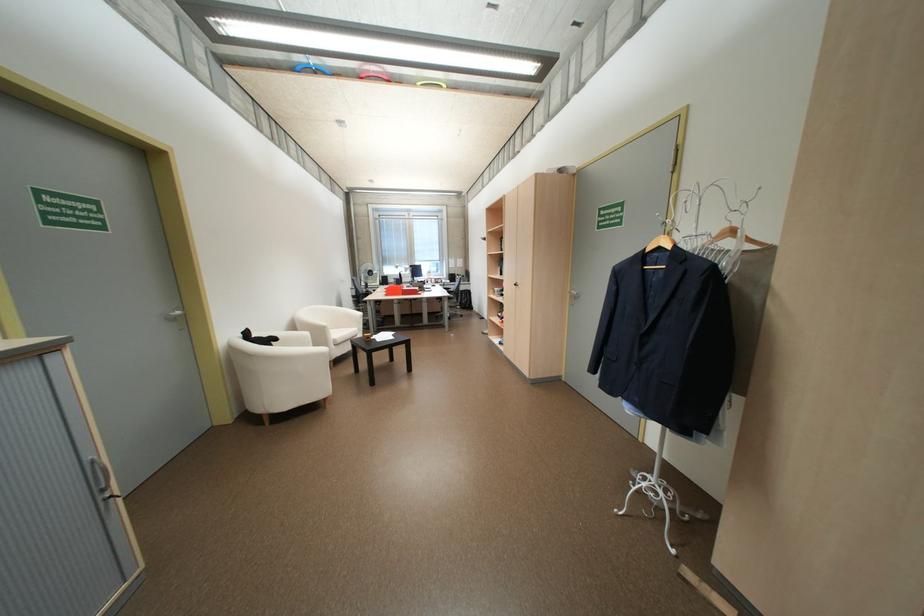
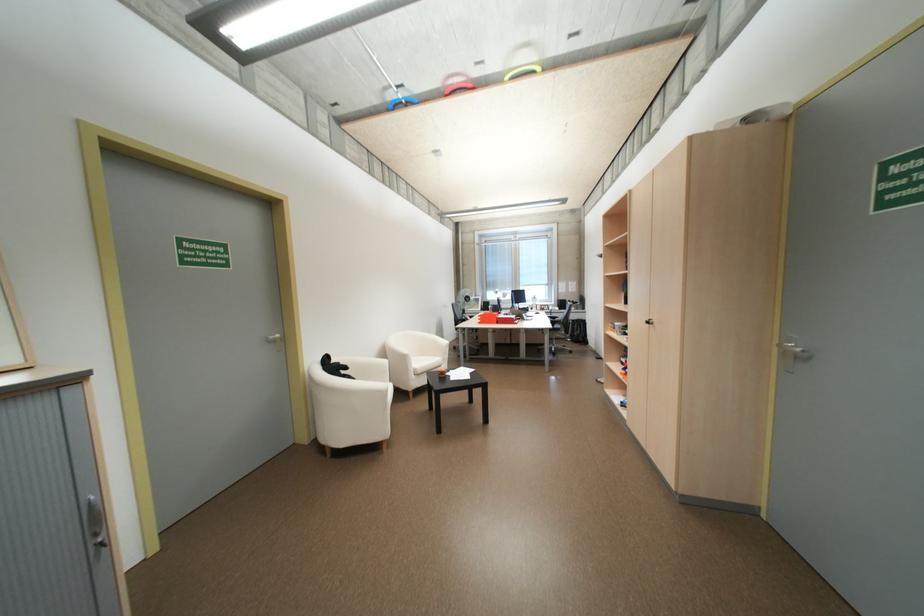
Locate, in the second image, the point that corresponds to pixel 580 296 in the first image.

(795, 353)